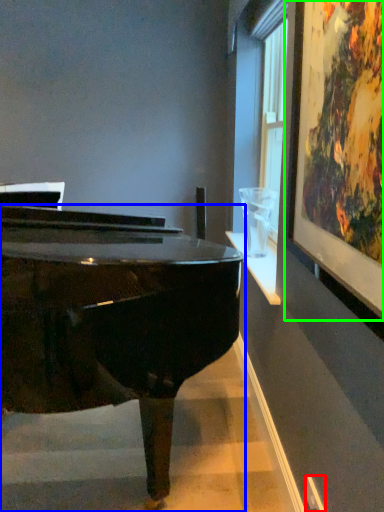
Question: Which object is positioned farthest from power outlet (highlighted by a red box)? Select from piano (highlighted by a blue box) and picture frame (highlighted by a green box).

Choices:
 (A) piano
 (B) picture frame

Answer: (B)